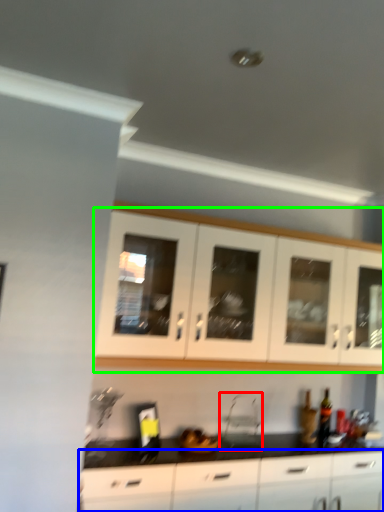
Question: Which object is positioned closest to appliance (highlighted by a red box)? Select from cabinetry (highlighted by a blue box) and cabinetry (highlighted by a green box).

Choices:
 (A) cabinetry
 (B) cabinetry

Answer: (A)